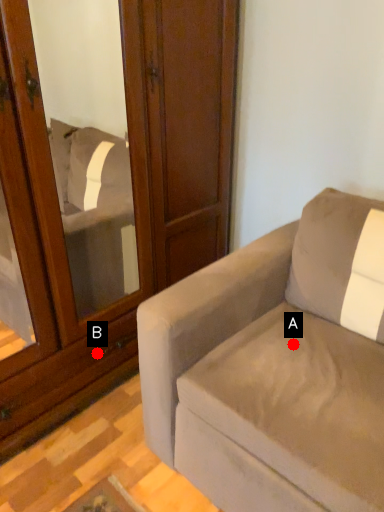
Question: Two points are circled on the image, labeled by A and B beside each circle. Which of the following is the farthest from the observer?

Choices:
 (A) A is further
 (B) B is further

Answer: (B)